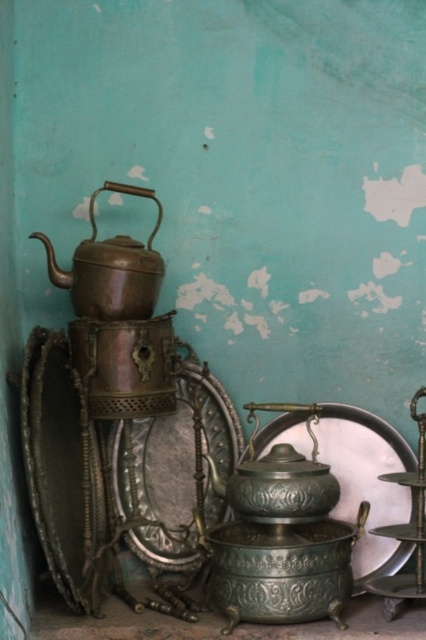
You are a chef organizing the kitchenware on the teal wall. You need to place a new item between the polished silver plate at center and the polished bronze teapot at center. Based on their positions, which object should the new item be closer to?

The polished silver plate at center is closer to the viewer than the polished bronze teapot at center, so the new item should be placed closer to the polished bronze teapot at center to maintain the spatial arrangement.

You are organizing a tea set display and need to place the bronze metallic teapot at upper left and the polished bronze teapot at center. Given the spacing between them, can you fit a 10 inch wide decorative plate between them without moving the teapots?

The bronze metallic teapot at upper left and polished bronze teapot at center are 17.51 inches apart. Since the decorative plate is 10 inches wide, there is enough space between them to fit it without moving the teapots.

You are an interior designer planning to hang a small shelf in this kitchen. The shelf will be placed exactly at coordinates point 0.420, 0.261. Will the bronze metallic teapot at upper left interfere with the shelf placement?

The bronze metallic teapot at upper left is located at point (111, 268), so placing the shelf at that exact coordinate will directly interfere with the teapot, making it impossible to install without moving the teapot.